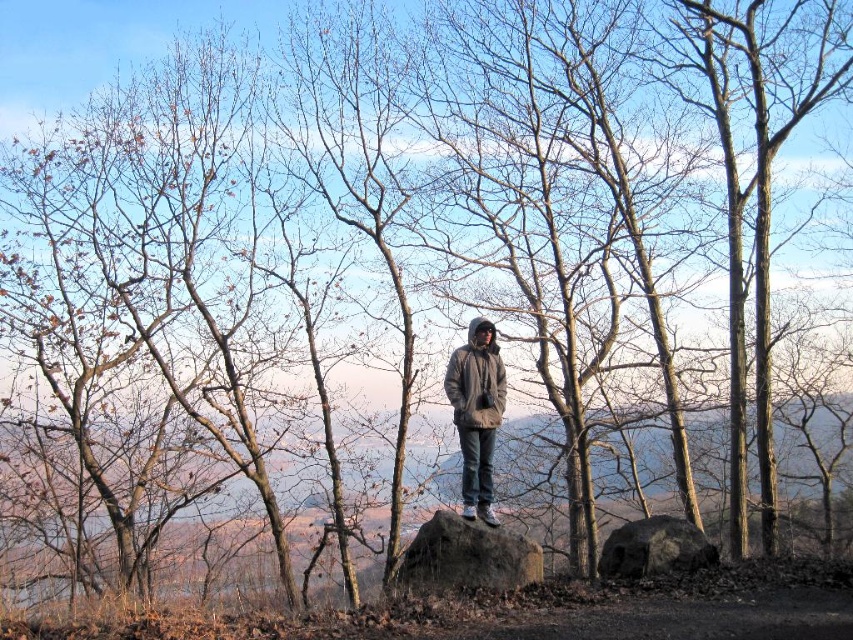
Consider the image. You are a hiker who wants to take a photo of the brown rough boulder at center. You are currently standing at the point with coordinates point (467, 556). Can you confirm if you are already positioned at the brown rough boulder at center?

Yes, the point (467, 556) corresponds to the brown rough boulder at center, so you are already positioned at the brown rough boulder at center.

You are planning to place a gray woolen jacket at center on top of the brown rough boulder at center. Based on the scene description, will the jacket fit entirely on the boulder?

The brown rough boulder at center is bigger than the gray woolen jacket at center, so the jacket will fit entirely on the boulder.

You are a hiker trying to cross a rocky area. You see the brown rough boulder at center and the dark gray rock at center. Which one should you step on if you want to avoid slipping?

The brown rough boulder at center has a rough surface, which provides better traction compared to the dark gray rock at center. Therefore, stepping on the brown rough boulder at center would be safer to avoid slipping.